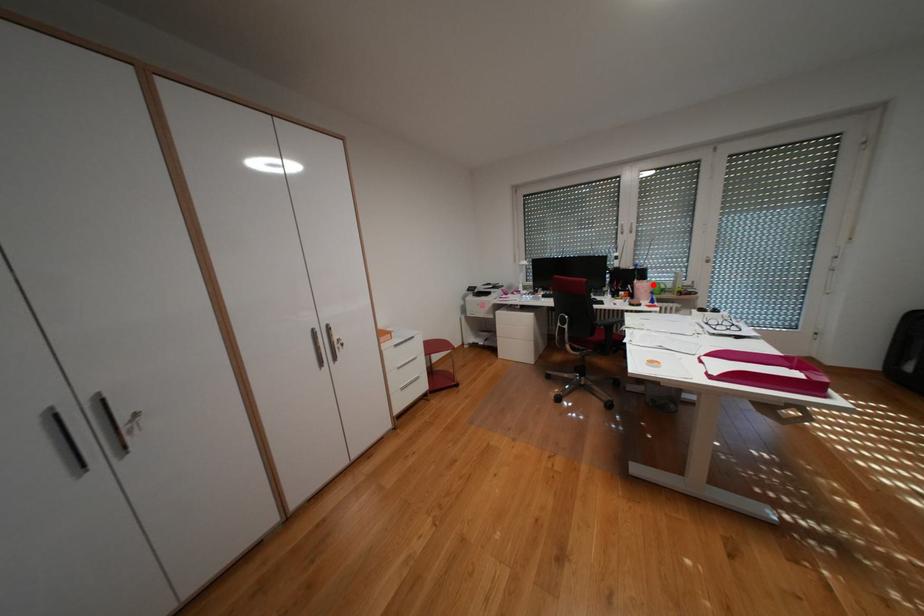
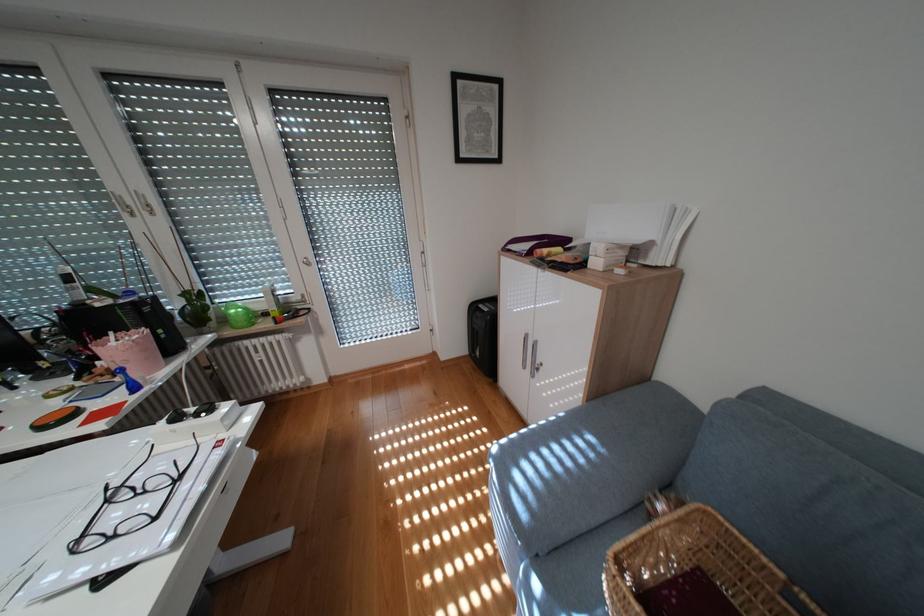
Where in the second image is the point corresponding to the highlighted location from the first image?

(136, 345)